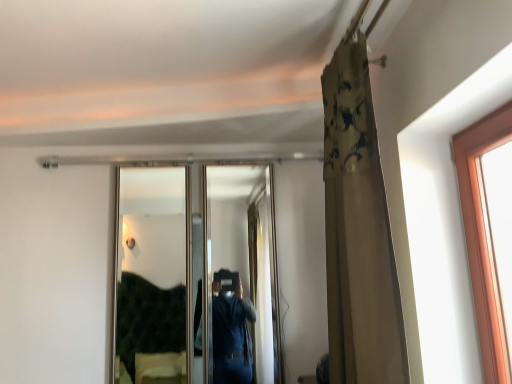
Measure the distance between clear glass mirror at center and camera.

clear glass mirror at center is 4.07 meters from camera.

Locate an element on the screen. The width and height of the screenshot is (512, 384). clear glass mirror at center is located at coordinates (229, 269).

What do you see at coordinates (229, 269) in the screenshot?
I see `clear glass mirror at center` at bounding box center [229, 269].

What do you see at coordinates (358, 232) in the screenshot? I see `floral fabric curtain at upper right` at bounding box center [358, 232].

The image size is (512, 384). Identify the location of floral fabric curtain at upper right. (358, 232).

At what (x,y) coordinates should I click in order to perform the action: click on clear glass mirror at center. Please return your answer as a coordinate pair (x, y). This screenshot has width=512, height=384. Looking at the image, I should click on (229, 269).

Is floral fabric curtain at upper right to the right of clear glass mirror at center from the viewer's perspective?

→ Indeed, floral fabric curtain at upper right is positioned on the right side of clear glass mirror at center.

Is floral fabric curtain at upper right in front of clear glass mirror at center?

Yes, the depth of floral fabric curtain at upper right is less than that of clear glass mirror at center.

Does point (328, 75) lie behind point (134, 211)?

No, it is in front of (134, 211).

Consider the image. From the image's perspective, is floral fabric curtain at upper right located above clear glass mirror at center?

Yes, from the image's perspective, floral fabric curtain at upper right is above clear glass mirror at center.

From a real-world perspective, who is located lower, floral fabric curtain at upper right or clear glass mirror at center?

clear glass mirror at center, from a real-world perspective.

Considering the sizes of objects floral fabric curtain at upper right and clear glass mirror at center in the image provided, who is thinner, floral fabric curtain at upper right or clear glass mirror at center?

clear glass mirror at center is thinner.

Consider the image. Which of these two, floral fabric curtain at upper right or clear glass mirror at center, stands shorter?

Standing shorter between the two is clear glass mirror at center.

Which of these two, floral fabric curtain at upper right or clear glass mirror at center, is smaller?

With smaller size is clear glass mirror at center.

Could clear glass mirror at center be considered to be inside floral fabric curtain at upper right?

No, floral fabric curtain at upper right does not contain clear glass mirror at center.

Is floral fabric curtain at upper right next to clear glass mirror at center and touching it?

They are not placed beside each other.

Is clear glass mirror at center at the back of floral fabric curtain at upper right?

No, floral fabric curtain at upper right is not facing the opposite direction of clear glass mirror at center.

You are a GUI agent. You are given a task and a screenshot of the screen. Output one action in this format:
    pyautogui.click(x=<x>, y=<y>)
    Task: Click on the mirror on the left side of floral fabric curtain at upper right
    
    Given the screenshot: What is the action you would take?
    pyautogui.click(x=229, y=269)

Is clear glass mirror at center to the left or to the right of floral fabric curtain at upper right in the image?

clear glass mirror at center is to the left of floral fabric curtain at upper right.

In the image, is clear glass mirror at center positioned in front of or behind floral fabric curtain at upper right?

clear glass mirror at center is behind floral fabric curtain at upper right.

Between point (135, 380) and point (354, 317), which one is positioned in front?

Point (354, 317)

From the image's perspective, which one is positioned higher, clear glass mirror at center or floral fabric curtain at upper right?

floral fabric curtain at upper right is shown above in the image.

From a real-world perspective, is clear glass mirror at center above or below floral fabric curtain at upper right?

Clearly, from a real-world perspective, clear glass mirror at center is below floral fabric curtain at upper right.

Considering the sizes of clear glass mirror at center and floral fabric curtain at upper right in the image, is clear glass mirror at center wider or thinner than floral fabric curtain at upper right?

Considering their sizes, clear glass mirror at center looks slimmer than floral fabric curtain at upper right.

Which of these two, clear glass mirror at center or floral fabric curtain at upper right, stands shorter?

With less height is clear glass mirror at center.

Can you confirm if clear glass mirror at center is smaller than floral fabric curtain at upper right?

Correct, clear glass mirror at center occupies less space than floral fabric curtain at upper right.

Is clear glass mirror at center situated inside floral fabric curtain at upper right or outside?

clear glass mirror at center is located beyond the bounds of floral fabric curtain at upper right.

Would you consider clear glass mirror at center to be distant from floral fabric curtain at upper right?

Indeed, clear glass mirror at center is not near floral fabric curtain at upper right.

Is clear glass mirror at center oriented away from floral fabric curtain at upper right?

No, clear glass mirror at center is not facing away from floral fabric curtain at upper right.

Can you tell me how much clear glass mirror at center and floral fabric curtain at upper right differ in facing direction?

The angle between the facing direction of clear glass mirror at center and the facing direction of floral fabric curtain at upper right is 91.4 degrees.

Identify the location of curtain in front of the clear glass mirror at center. This screenshot has width=512, height=384. (358, 232).

Identify the location of curtain that appears above the clear glass mirror at center (from the image's perspective). pyautogui.click(x=358, y=232).

Where is `mirror below the floral fabric curtain at upper right (from a real-world perspective)`? mirror below the floral fabric curtain at upper right (from a real-world perspective) is located at coordinates (229, 269).